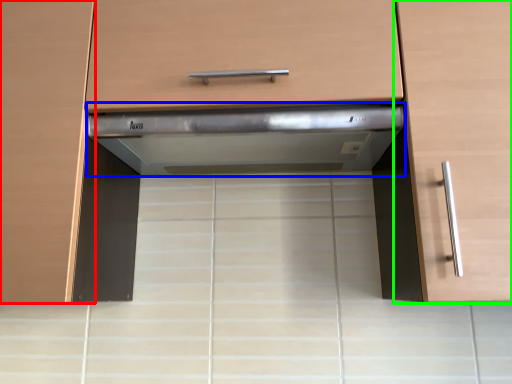
Question: Considering the real-world distances, which object is farthest from cabinetry (highlighted by a red box)? home appliance (highlighted by a blue box) or cabinetry (highlighted by a green box)?

Choices:
 (A) home appliance
 (B) cabinetry

Answer: (B)